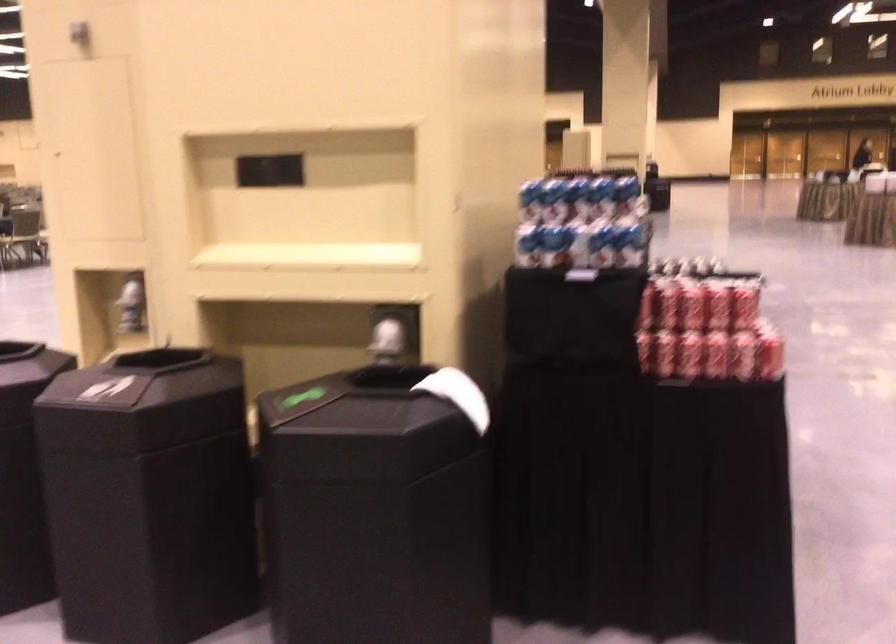
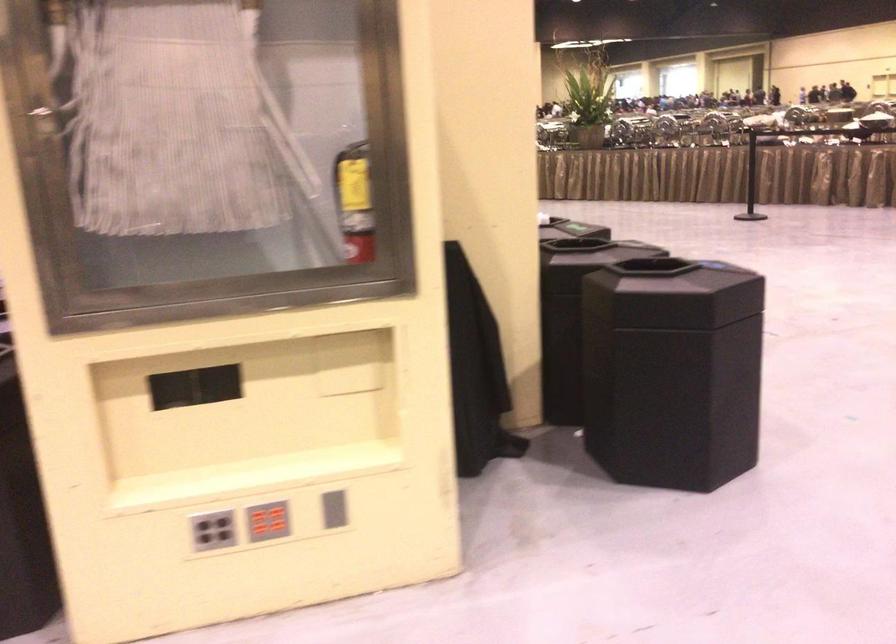
Question: I am providing you with two images of the same scene from different viewpoints. Please identify which objects are invisible in image2.

Choices:
 (A) blue and white can
 (B) red button panel
 (C) grey vertical slot
 (D) bee-shaped magnet

Answer: (A)